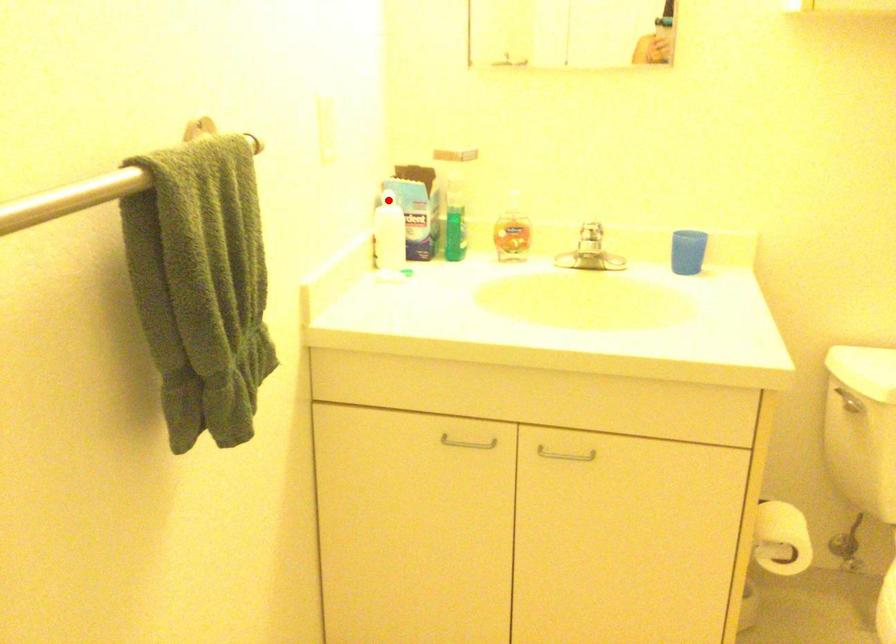
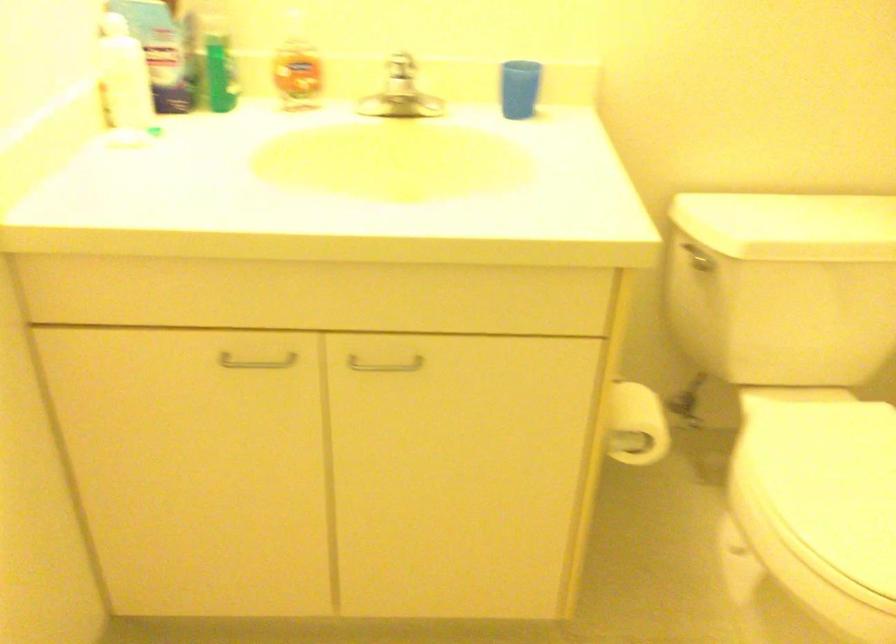
Where in the second image is the point corresponding to the highlighted location from the first image?

(113, 26)